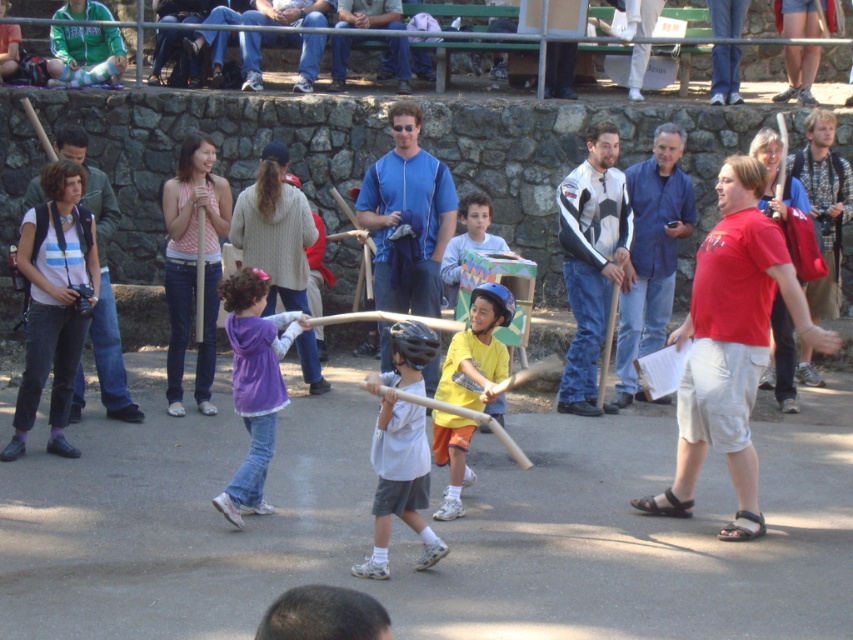
Question: Which of these objects is positioned farthest from the white and black striped jacket at center?

Choices:
 (A) denim jeans at upper center
 (B) purple fleece jacket at center
 (C) matte black camera at left
 (D) blue zip-up jacket at center

Answer: (A)

Question: Is denim jeans at upper center below green fleece jacket at upper left?

Choices:
 (A) no
 (B) yes

Answer: (B)

Question: Is yellow matte shirt at center smaller than blue denim jeans at upper center?

Choices:
 (A) no
 (B) yes

Answer: (B)

Question: Among these points, which one is nearest to the camera?

Choices:
 (A) (439, 454)
 (B) (244, 320)
 (C) (436, 205)

Answer: (B)

Question: Among these objects, which one is farthest from the camera?

Choices:
 (A) green fleece jacket at upper left
 (B) white matte baseball bat at center
 (C) white and black leather jacket at center

Answer: (A)

Question: In this image, where is denim jeans at upper center located relative to green fleece jacket at upper left?

Choices:
 (A) above
 (B) below

Answer: (B)